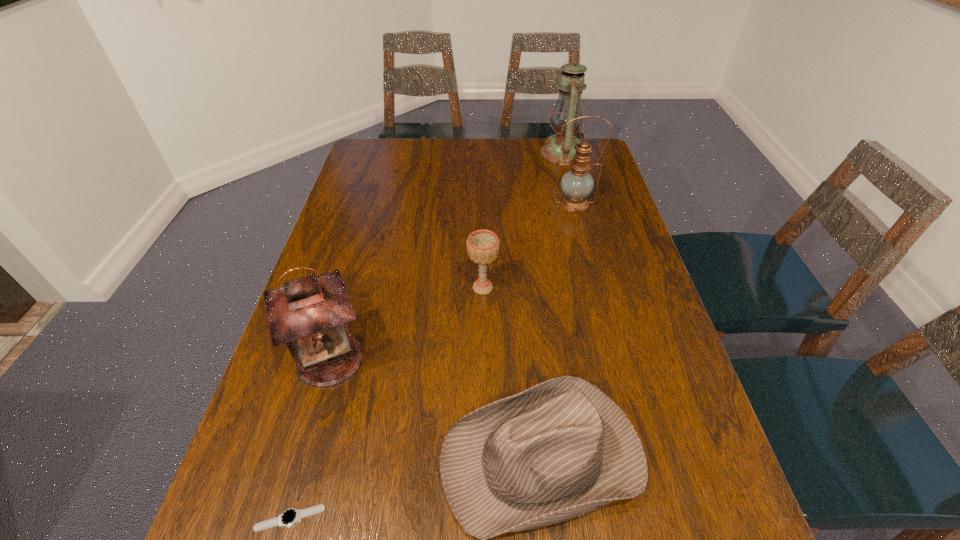
Locate an element on the screen. This screenshot has width=960, height=540. vacant region located 0.120m on the back of the fourth nearest object is located at coordinates (483, 247).

I want to click on vacant space situated on the back of the shortest object, so click(x=312, y=438).

Locate an element on the screen. object present at the far edge is located at coordinates (571, 85).

You are a GUI agent. You are given a task and a screenshot of the screen. Output one action in this format:
    pyautogui.click(x=<x>, y=<y>)
    Task: Click on the oil lamp that is at the left edge
    
    Given the screenshot: What is the action you would take?
    pyautogui.click(x=310, y=314)

Identify the location of watch positioned at the left edge. This screenshot has height=540, width=960. (289, 517).

Locate an element on the screen. The image size is (960, 540). object that is at the far right corner is located at coordinates (571, 85).

You are a GUI agent. You are given a task and a screenshot of the screen. Output one action in this format:
    pyautogui.click(x=<x>, y=<y>)
    Task: Click on the free space at the far edge of the desktop
    The height and width of the screenshot is (540, 960).
    Given the screenshot: What is the action you would take?
    pyautogui.click(x=533, y=164)

Locate an element on the screen. blank space at the left edge of the desktop is located at coordinates (383, 241).

Where is `vacant region at the right edge of the desktop`? vacant region at the right edge of the desktop is located at coordinates (614, 220).

Image resolution: width=960 pixels, height=540 pixels. In the image, there is a desktop. Find the location of `blank space at the far left corner`. blank space at the far left corner is located at coordinates (364, 143).